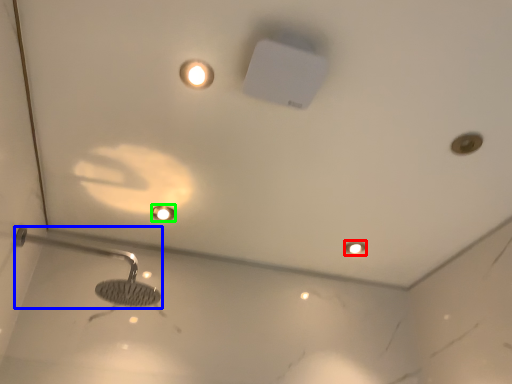
Question: Which is farther away from light fixture (highlighted by a red box)? shower (highlighted by a blue box) or droplight (highlighted by a green box)?

Choices:
 (A) shower
 (B) droplight

Answer: (A)